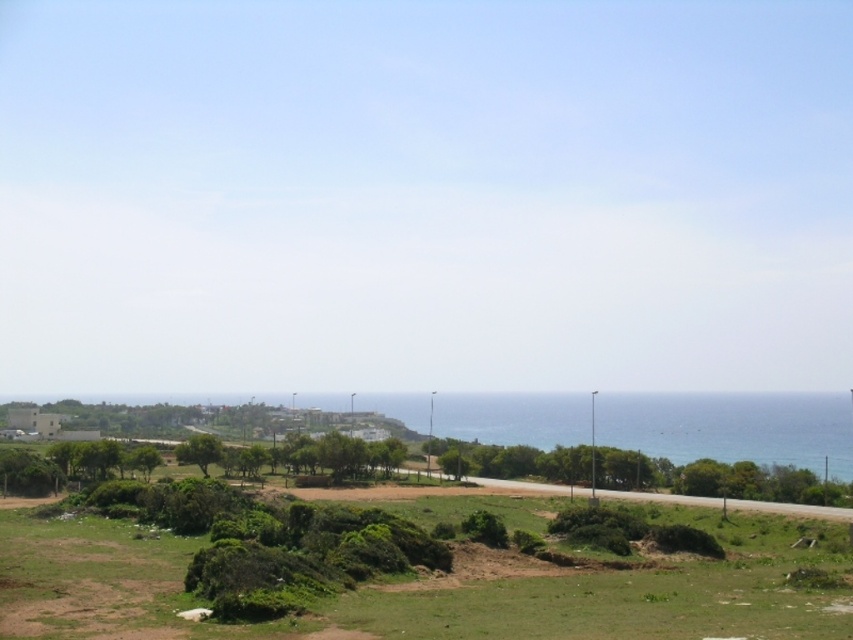
Question: Which point is farther to the camera?

Choices:
 (A) (186, 464)
 (B) (567, 474)

Answer: (B)

Question: Is green leafy tree at lower center to the left of green leafy tree at lower left from the viewer's perspective?

Choices:
 (A) no
 (B) yes

Answer: (A)

Question: Is green leafy tree at lower center above green leafy tree at lower left?

Choices:
 (A) no
 (B) yes

Answer: (A)

Question: Which point is farther from the camera taking this photo?

Choices:
 (A) (711, 484)
 (B) (212, 449)

Answer: (B)

Question: Can you confirm if green leafy tree at lower center is positioned to the left of green leafy tree at lower left?

Choices:
 (A) no
 (B) yes

Answer: (A)